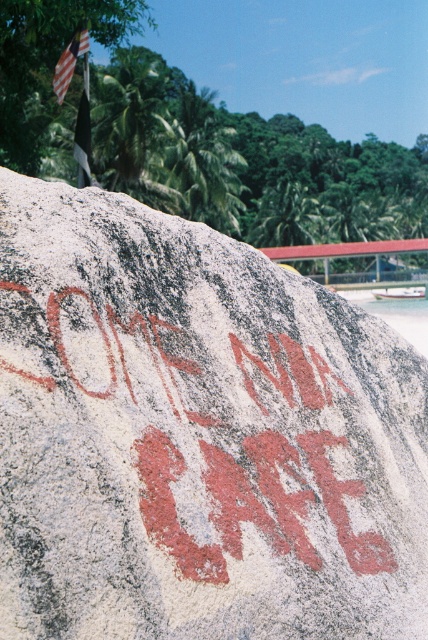
You are standing in front of a large rock with a message painted on it. There is a point marked at coordinates [196,436]. What object does this point correspond to?

→ The point at coordinates [196,436] corresponds to the reddish brown stone at center.